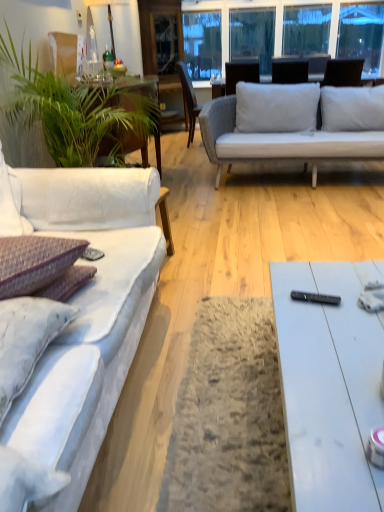
The image size is (384, 512). In order to click on free space behind black plastic remote control at center in this screenshot , I will do `click(307, 279)`.